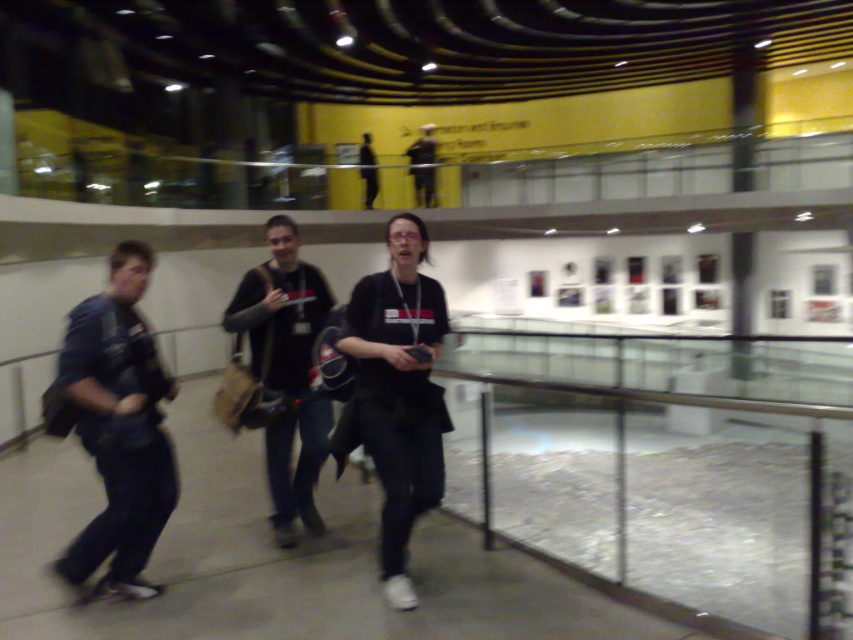
Between point (405, 609) and point (288, 458), which one is positioned in front?

Point (405, 609) is more forward.

Who is higher up, black matte shirt at center or dark gray fabric jacket at center?

Positioned higher is dark gray fabric jacket at center.

Which is in front, point (401, 468) or point (318, 435)?

Point (401, 468) is in front.

Where is `black matte shirt at center`? This screenshot has width=853, height=640. black matte shirt at center is located at coordinates (398, 392).

Does dark blue fabric jacket at left lie behind black matte shirt at center?

Yes, dark blue fabric jacket at left is behind black matte shirt at center.

Does dark blue fabric jacket at left appear on the right side of black matte shirt at center?

In fact, dark blue fabric jacket at left is to the left of black matte shirt at center.

Is point (113, 417) behind point (399, 376)?

No, it is not.

Locate an element on the screen. The width and height of the screenshot is (853, 640). dark blue fabric jacket at left is located at coordinates (119, 426).

Does dark blue fabric jacket at left have a lesser width compared to dark gray fabric jacket at center?

No, dark blue fabric jacket at left is not thinner than dark gray fabric jacket at center.

This screenshot has width=853, height=640. Identify the location of dark blue fabric jacket at left. (119, 426).

Where is `dark blue fabric jacket at left`? This screenshot has width=853, height=640. dark blue fabric jacket at left is located at coordinates (119, 426).